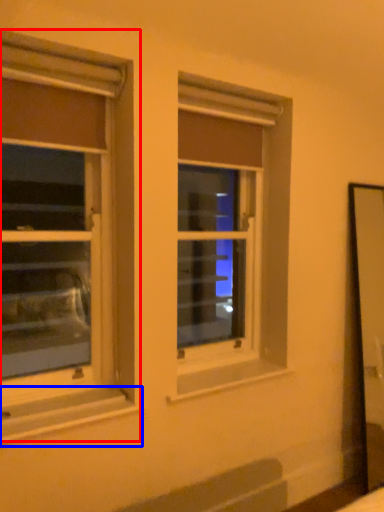
Question: Which object is further to the camera taking this photo, window (highlighted by a red box) or window sill (highlighted by a blue box)?

Choices:
 (A) window
 (B) window sill

Answer: (A)